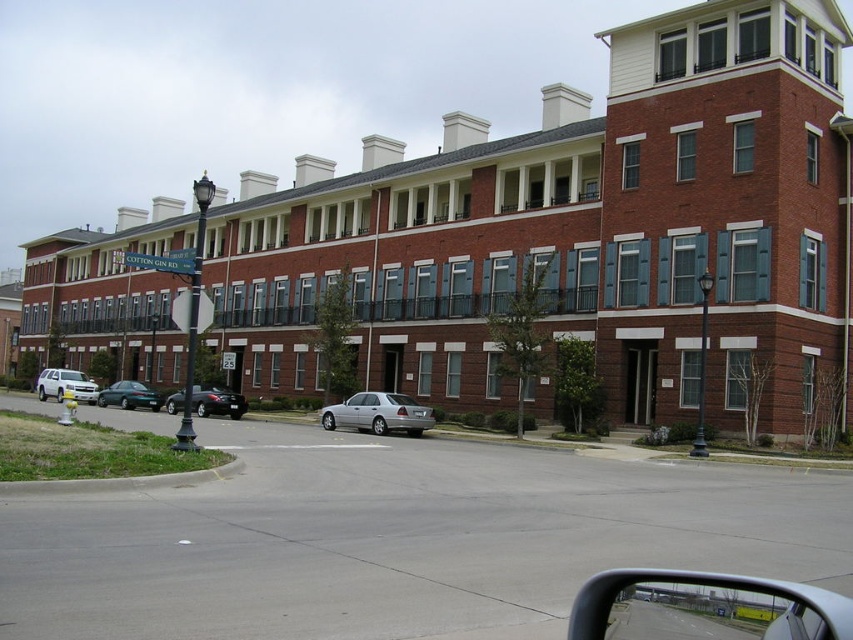
You are standing at the camera position and want to walk to point (384, 396). Is the distance more than 30 meters?

The distance between point (384, 396) and the camera is 30.75 meters, so yes, it is more than 30 meters.

You are standing on the sidewalk in front of the building and notice two points marked on the ground. The first point is labeled as point (x=405, y=419) and the second as point (x=169, y=397). Which point is closer to you?

Point (x=405, y=419) is closer to the viewer than point (x=169, y=397).